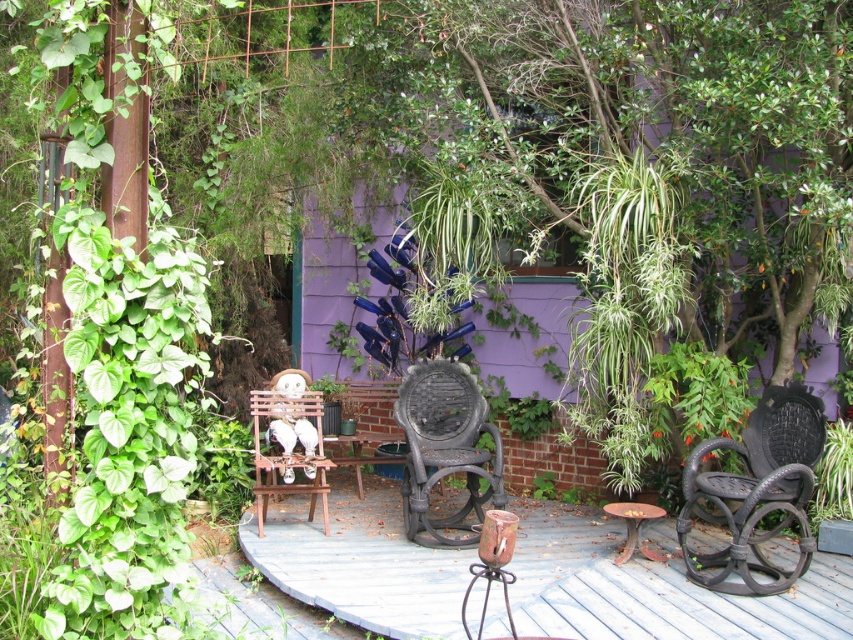
Can you confirm if rustic wood table at center is taller than black wicker chair at center?

No, rustic wood table at center is not taller than black wicker chair at center.

Can you confirm if rustic wood table at center is smaller than black wicker chair at center?

Actually, rustic wood table at center might be larger than black wicker chair at center.

What are the coordinates of `rustic wood table at center` in the screenshot? It's located at (653, 586).

At what (x,y) coordinates should I click in order to perform the action: click on rustic wood table at center. Please return your answer as a coordinate pair (x, y). Image resolution: width=853 pixels, height=640 pixels. Looking at the image, I should click on point(653,586).

Between black woven chair at right and black wicker chair at center, which one is positioned higher?

black wicker chair at center is higher up.

Does point (805, 545) come closer to viewer compared to point (398, 406)?

Yes, it is.

Who is more distant from viewer, (x=764, y=582) or (x=451, y=426)?

The point (x=451, y=426) is behind.

Where is `black woven chair at right`? black woven chair at right is located at coordinates (756, 490).

Which is behind, point (413, 428) or point (318, 483)?

Point (318, 483)

The width and height of the screenshot is (853, 640). What are the coordinates of `black wicker chair at center` in the screenshot? It's located at (445, 448).